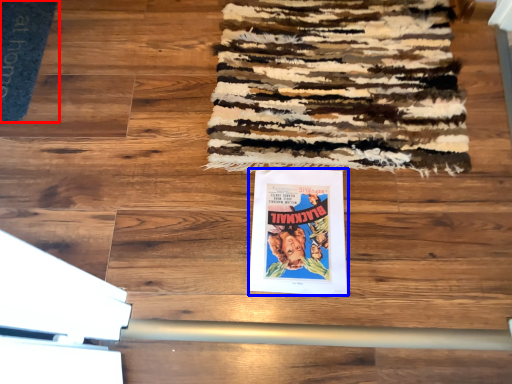
Question: Which point is further to the camera, doormat (highlighted by a red box) or poster (highlighted by a blue box)?

Choices:
 (A) doormat
 (B) poster

Answer: (A)